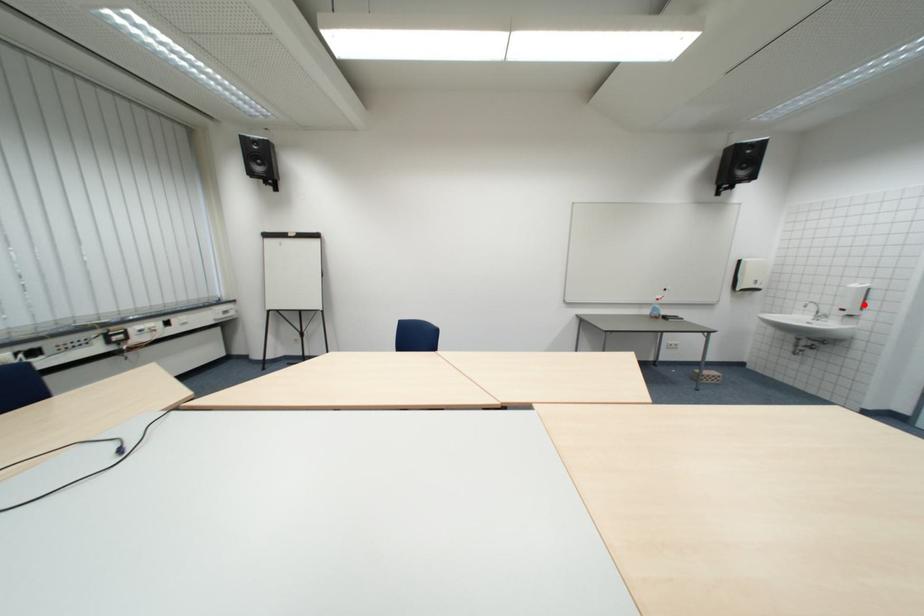
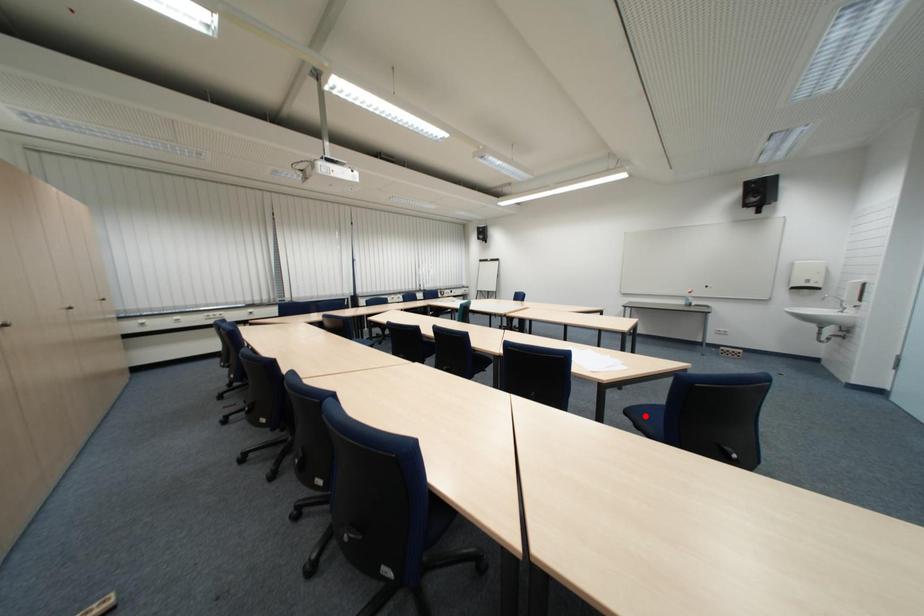
I am providing you with two images of the same scene from different viewpoints. A red point is marked on the first image and another point is marked on the second image. Does the point marked in image1 correspond to the same location as the one in image2?

No